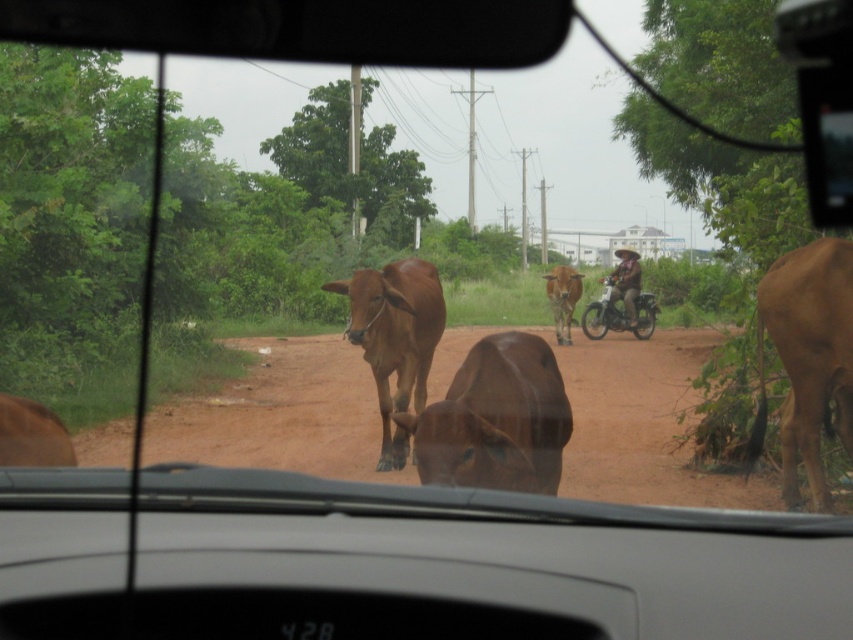
Question: Considering the real-world distances, which object is closest to the brown matte cow at center?

Choices:
 (A) brown matte bull at right
 (B) brown matte bull at center
 (C) brown dirt track at center
 (D) metallic silver motorcycle at center

Answer: (A)

Question: Is brown matte bull at right to the right of metallic silver motorcycle at center from the viewer's perspective?

Choices:
 (A) yes
 (B) no

Answer: (B)

Question: Considering the relative positions of brown matte bull at right and brown matte cow at center in the image provided, where is brown matte bull at right located with respect to brown matte cow at center?

Choices:
 (A) right
 (B) left

Answer: (A)

Question: Which object is the closest to the brown matte bull at center?

Choices:
 (A) brown matte bull at right
 (B) brown matte cow at center
 (C) metallic silver motorcycle at center
 (D) brown dirt track at center

Answer: (A)

Question: Which is farther from the brown matte bull at center?

Choices:
 (A) metallic silver motorcycle at center
 (B) brown dirt track at center
 (C) brown matte cow at center

Answer: (A)

Question: Can you confirm if brown matte bull at center is positioned to the right of brown matte bull at right?

Choices:
 (A) yes
 (B) no

Answer: (B)